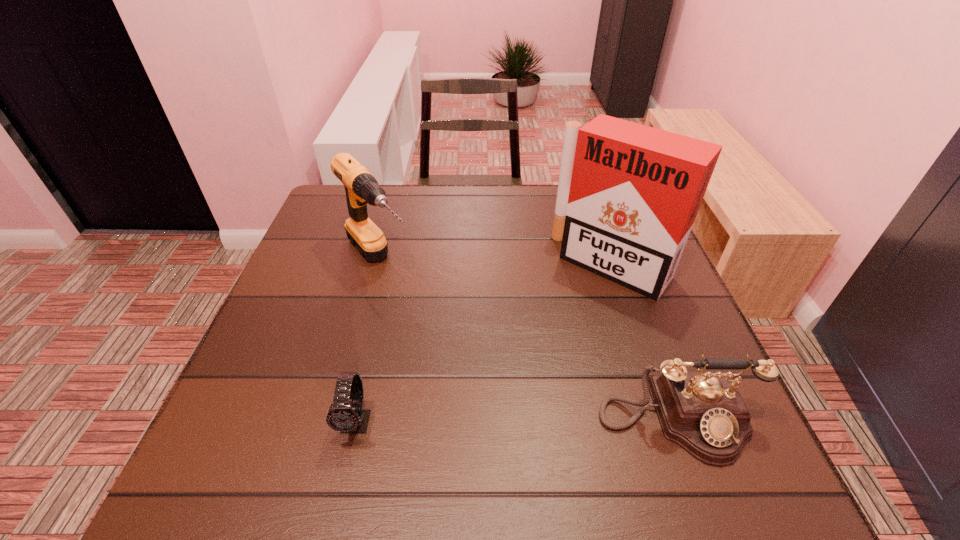
Identify the location of vacant region at the left edge of the desktop. Image resolution: width=960 pixels, height=540 pixels. (324, 339).

Image resolution: width=960 pixels, height=540 pixels. I want to click on free region at the far left corner of the desktop, so click(x=341, y=185).

At what (x,y) coordinates should I click in order to perform the action: click on empty location between the telephone and the second tallest object. Please return your answer as a coordinate pair (x, y). This screenshot has width=960, height=540. Looking at the image, I should click on (528, 341).

This screenshot has height=540, width=960. Find the location of `unoccupied position between the watch and the drill`. unoccupied position between the watch and the drill is located at coordinates (368, 342).

Identify the location of vacant space that is in between the cigarette case and the watch. (485, 343).

Image resolution: width=960 pixels, height=540 pixels. In order to click on vacant area that lies between the drill and the shortest object in this screenshot , I will do `click(368, 342)`.

Locate an element on the screen. free spot between the tallest object and the watch is located at coordinates (485, 343).

Identify the location of vacant area that lies between the tallest object and the second shortest object. (644, 342).

In order to click on free spot between the third tallest object and the drill in this screenshot , I will do `click(528, 341)`.

The width and height of the screenshot is (960, 540). Find the location of `free space between the telephone and the drill`. free space between the telephone and the drill is located at coordinates (528, 341).